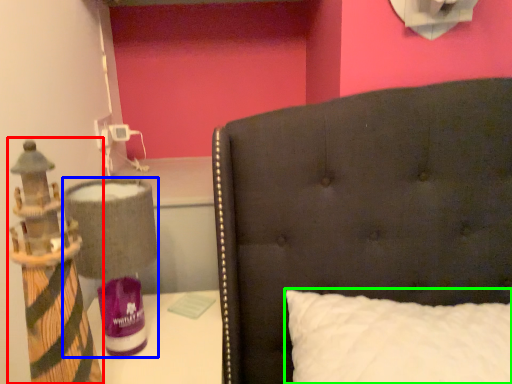
Question: Considering the real-world distances, which object is farthest from toy (highlighted by a red box)? table lamp (highlighted by a blue box) or pillow (highlighted by a green box)?

Choices:
 (A) table lamp
 (B) pillow

Answer: (B)